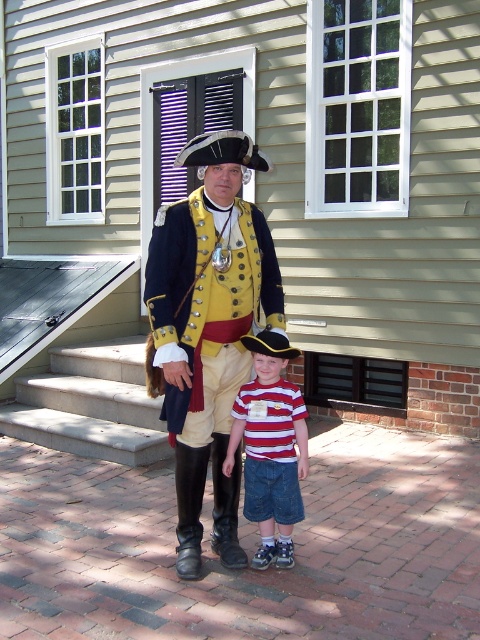
Between concrete stairs at center and striped cotton shirt at center, which one appears on the left side from the viewer's perspective?

Positioned to the left is concrete stairs at center.

Which is below, concrete stairs at center or striped cotton shirt at center?

Positioned lower is concrete stairs at center.

The image size is (480, 640). Describe the element at coordinates (91, 404) in the screenshot. I see `concrete stairs at center` at that location.

Find the location of `concrete stairs at center`. concrete stairs at center is located at coordinates (91, 404).

Which is behind, point (184, 467) or point (132, 464)?

The point (132, 464) is more distant.

Does matte gold uniform at center lie in front of concrete stairs at center?

Yes, it is.

Which is in front, point (212, 534) or point (106, 356)?

Point (212, 534) is more forward.

Locate an element on the screen. matte gold uniform at center is located at coordinates (207, 328).

Is point (212, 256) more distant than point (272, 532)?

No, it is not.

Does matte gold uniform at center have a greater height compared to striped cotton shirt at center?

Correct, matte gold uniform at center is much taller as striped cotton shirt at center.

Measure the distance between matte gold uniform at center and camera.

matte gold uniform at center is 11.53 feet away from camera.

Where is `matte gold uniform at center`? The width and height of the screenshot is (480, 640). matte gold uniform at center is located at coordinates (207, 328).